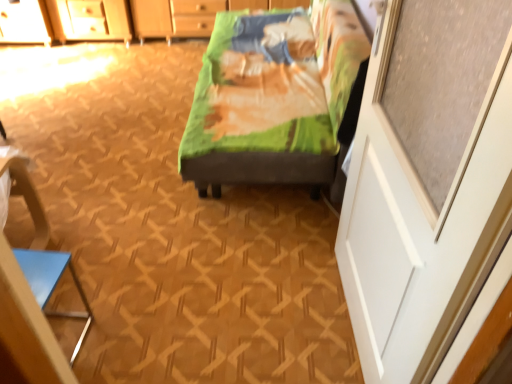
At what (x,y) coordinates should I click in order to perform the action: click on free space behind blue glossy triangle at lower left. Please return your answer as a coordinate pair (x, y). Image resolution: width=512 pixels, height=384 pixels. Looking at the image, I should click on (89, 292).